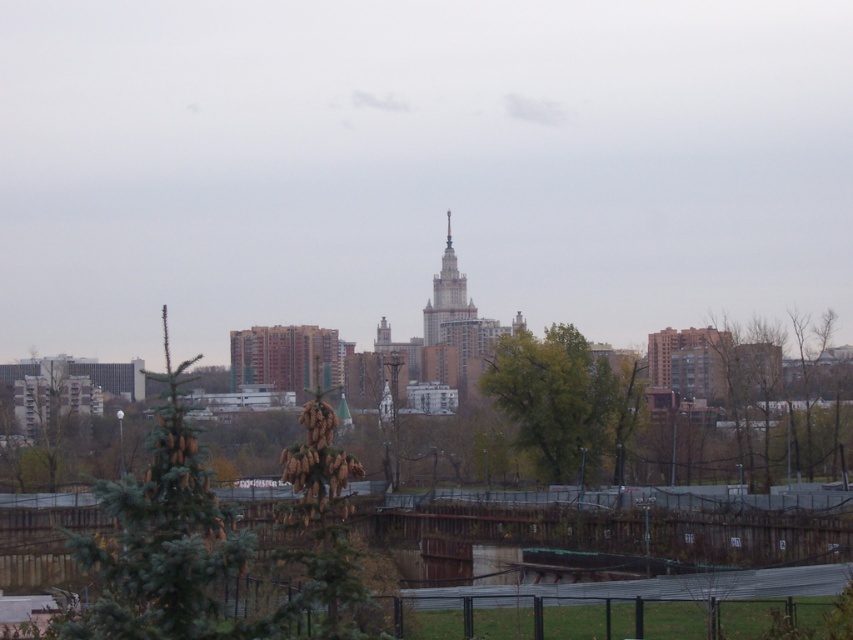
Between green matte tree at left and green leafy tree at center, which one appears on the left side from the viewer's perspective?

green matte tree at left is more to the left.

Can you confirm if green matte tree at left is thinner than green leafy tree at center?

Correct, green matte tree at left's width is less than green leafy tree at center's.

Image resolution: width=853 pixels, height=640 pixels. What are the coordinates of `green matte tree at left` in the screenshot? It's located at (163, 541).

Does brown textured pine cone at center appear on the right side of polished silver spire at center?

In fact, brown textured pine cone at center is to the left of polished silver spire at center.

Between brown textured pine cone at center and polished silver spire at center, which one is positioned lower?

Positioned lower is brown textured pine cone at center.

Between point (318, 552) and point (462, 317), which one is positioned in front?

Positioned in front is point (318, 552).

Where is `brown textured pine cone at center`? Image resolution: width=853 pixels, height=640 pixels. brown textured pine cone at center is located at coordinates (322, 515).

Which is below, green leafy tree at center or polished silver spire at center?

Positioned lower is green leafy tree at center.

Is green leafy tree at center positioned before polished silver spire at center?

Yes, it is in front of polished silver spire at center.

Locate an element on the screen. Image resolution: width=853 pixels, height=640 pixels. green leafy tree at center is located at coordinates (560, 397).